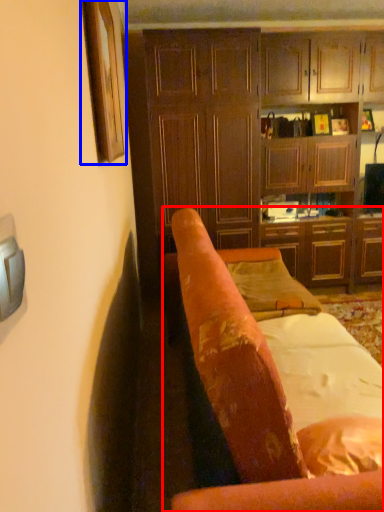
Question: Which point is closer to the camera, chair (highlighted by a red box) or picture frame (highlighted by a blue box)?

Choices:
 (A) chair
 (B) picture frame

Answer: (A)